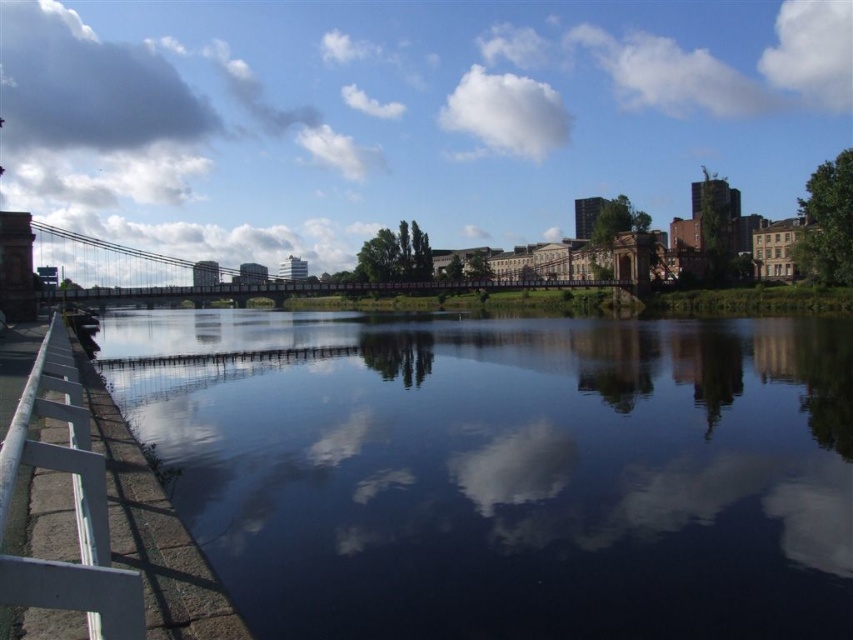
Question: From the image, what is the correct spatial relationship of black reflective water at center in relation to metallic gray suspension bridge at center?

Choices:
 (A) above
 (B) below

Answer: (B)

Question: Does black reflective water at center appear over white metal rail at lower left?

Choices:
 (A) no
 (B) yes

Answer: (B)

Question: Does black reflective water at center have a lesser width compared to white metal rail at lower left?

Choices:
 (A) yes
 (B) no

Answer: (B)

Question: Which of the following is the closest to the observer?

Choices:
 (A) white metal rail at lower left
 (B) metallic gray suspension bridge at center

Answer: (A)

Question: Which point is closer to the camera taking this photo?

Choices:
 (A) (302, 381)
 (B) (102, 570)

Answer: (B)

Question: Which object is positioned farthest from the white metal rail at lower left?

Choices:
 (A) black reflective water at center
 (B) metallic gray suspension bridge at center

Answer: (B)